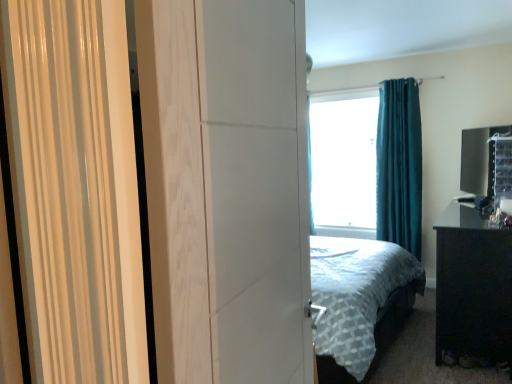
Question: Would you say teal velvet curtain at upper right is part of white matte screen door at center's contents?

Choices:
 (A) no
 (B) yes

Answer: (A)

Question: From a real-world perspective, does white matte screen door at center sit lower than teal velvet curtain at upper right?

Choices:
 (A) yes
 (B) no

Answer: (B)

Question: Is white matte screen door at center directly adjacent to teal velvet curtain at upper right?

Choices:
 (A) no
 (B) yes

Answer: (A)

Question: Is white matte screen door at center outside teal velvet curtain at upper right?

Choices:
 (A) yes
 (B) no

Answer: (A)

Question: From the image's perspective, is white matte screen door at center below teal velvet curtain at upper right?

Choices:
 (A) yes
 (B) no

Answer: (A)

Question: Is transparent glass window screen at center in front of or behind black glossy nightstand at right in the image?

Choices:
 (A) front
 (B) behind

Answer: (B)

Question: Considering the positions of transparent glass window screen at center and black glossy nightstand at right in the image, is transparent glass window screen at center bigger or smaller than black glossy nightstand at right?

Choices:
 (A) small
 (B) big

Answer: (A)

Question: Does point (356, 213) appear closer or farther from the camera than point (501, 306)?

Choices:
 (A) farther
 (B) closer

Answer: (A)

Question: From their relative heights in the image, would you say transparent glass window screen at center is taller or shorter than black glossy nightstand at right?

Choices:
 (A) short
 (B) tall

Answer: (B)

Question: Visually, is teal velvet curtain at upper right positioned to the left or to the right of black glossy nightstand at right?

Choices:
 (A) right
 (B) left

Answer: (B)

Question: Considering their positions, is teal velvet curtain at upper right located in front of or behind black glossy nightstand at right?

Choices:
 (A) front
 (B) behind

Answer: (B)

Question: Is teal velvet curtain at upper right taller or shorter than black glossy nightstand at right?

Choices:
 (A) short
 (B) tall

Answer: (B)

Question: Does point (384, 216) appear closer or farther from the camera than point (494, 337)?

Choices:
 (A) closer
 (B) farther

Answer: (B)

Question: From the image's perspective, is black glossy nightstand at right located above or below teal velvet curtain at upper right?

Choices:
 (A) below
 (B) above

Answer: (A)

Question: Is black glossy nightstand at right in front of or behind teal velvet curtain at upper right in the image?

Choices:
 (A) behind
 (B) front

Answer: (B)